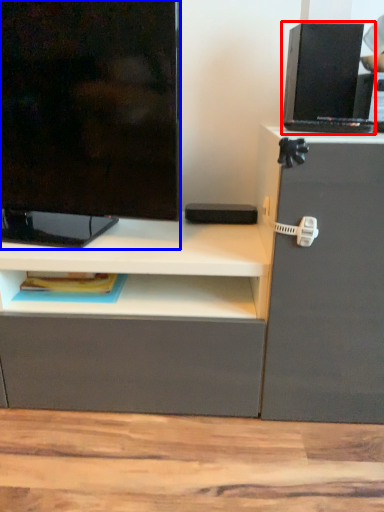
Question: Which of the following is the farthest to the observer, computer (highlighted by a red box) or television (highlighted by a blue box)?

Choices:
 (A) computer
 (B) television

Answer: (A)